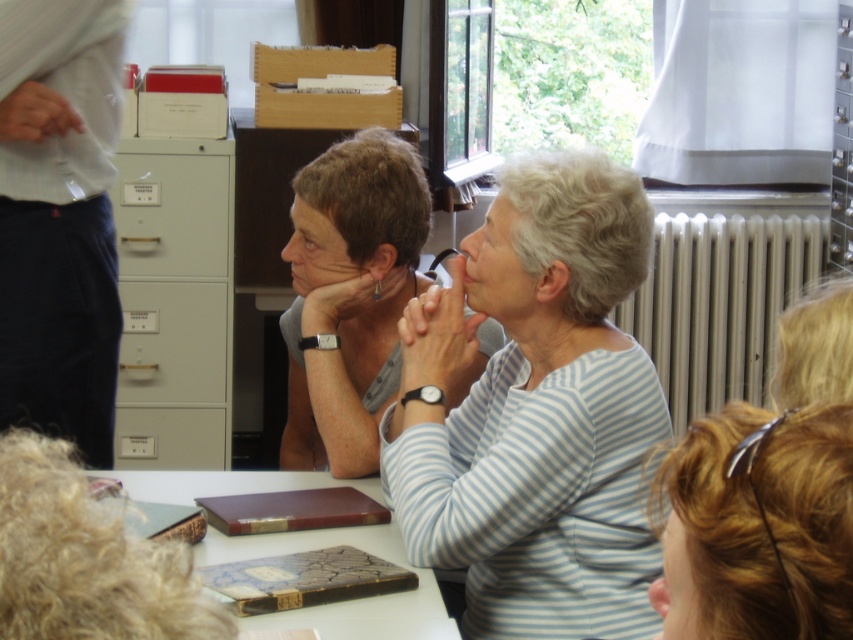
You are attending a meeting and notice two colleagues seated at the table. One is wearing a light blue striped shirt at center, and the other has a matte gray shirt at center. From your perspective facing the table, which shirt is located to the left?

The matte gray shirt at center is located to the left of the light blue striped shirt at center.

You are standing at the entrance of the room and want to approach the light blue striped shirt at center. Which direction should you walk to reach it?

Since the light blue striped shirt at center is located at point 0.642 on the x axis and 0.628 on the y axis, you should walk towards the center of the room to reach it.

You are standing in the room and want to determine which of the two points, point (343, 416) or point (216, 320), is nearer to you. Based on the scene description, which point is closer?

Point (343, 416) is closer to the viewer than point (216, 320).